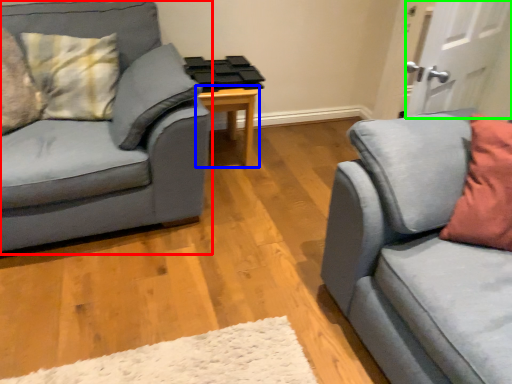
Question: Considering the real-world distances, which object is closest to studio couch (highlighted by a red box)? table (highlighted by a blue box) or door (highlighted by a green box).

Choices:
 (A) table
 (B) door

Answer: (A)